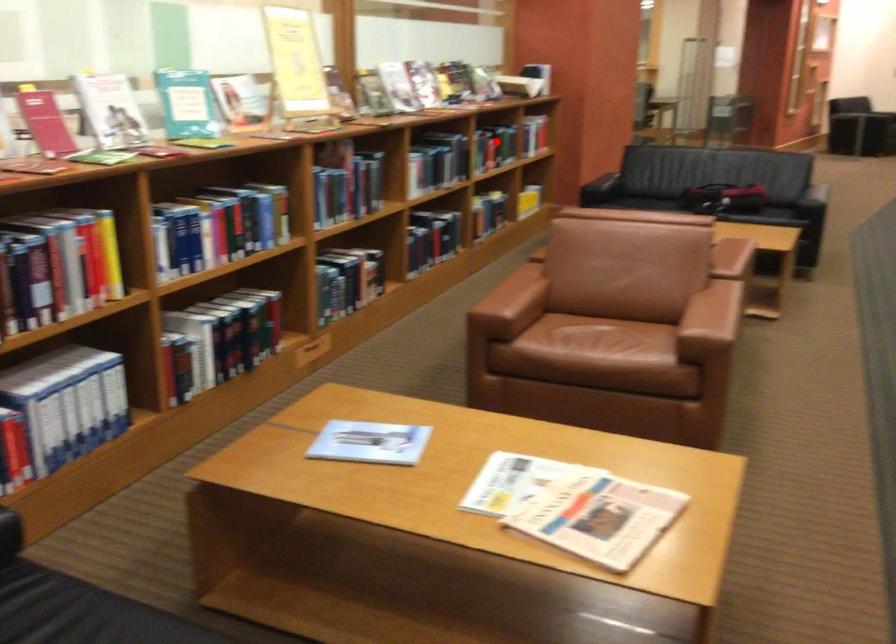
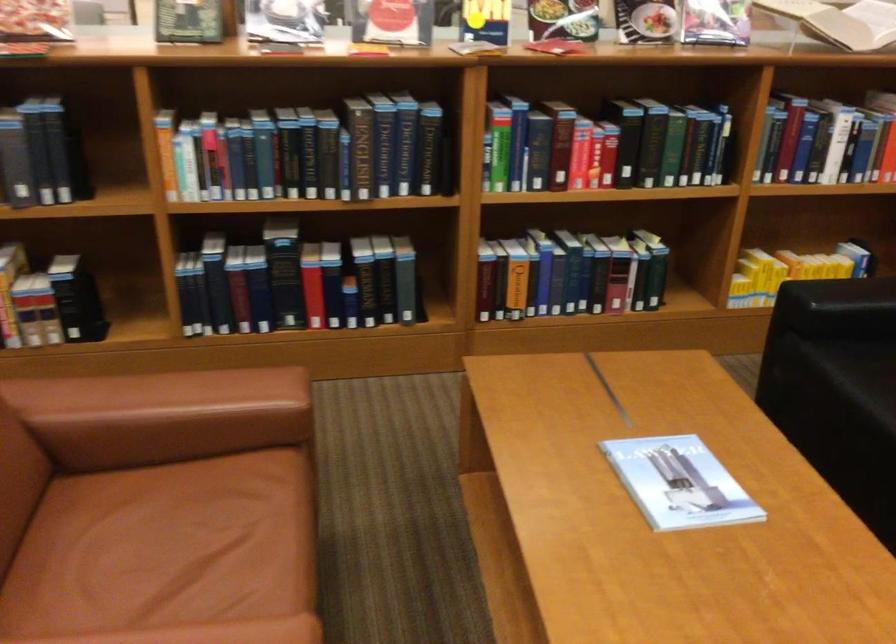
The point at the highlighted location is marked in the first image. Where is the corresponding point in the second image?

(601, 146)